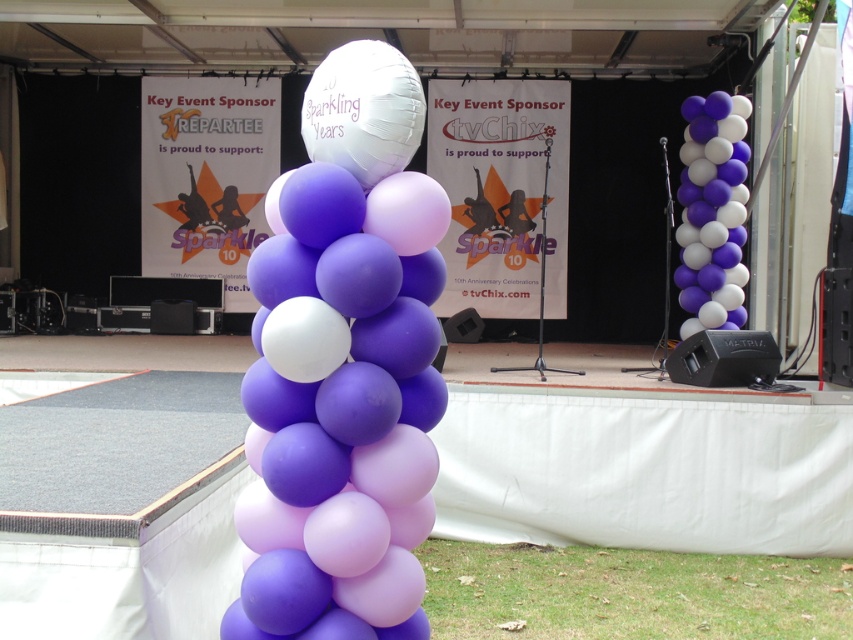
Question: Does matte purple balloons at center have a larger size compared to purple matte balloons at right?

Choices:
 (A) no
 (B) yes

Answer: (A)

Question: Observing the image, what is the correct spatial positioning of matte purple balloons at center in reference to purple matte balloons at right?

Choices:
 (A) below
 (B) above

Answer: (A)

Question: Is matte purple balloons at center thinner than purple matte balloons at right?

Choices:
 (A) no
 (B) yes

Answer: (B)

Question: Which object is closer to the camera taking this photo?

Choices:
 (A) matte purple balloons at center
 (B) purple matte balloons at right

Answer: (A)

Question: Which point appears farthest from the camera in this image?

Choices:
 (A) (393, 280)
 (B) (704, 147)

Answer: (B)

Question: Which object appears farthest from the camera in this image?

Choices:
 (A) matte purple balloons at center
 (B) purple matte balloons at right

Answer: (B)